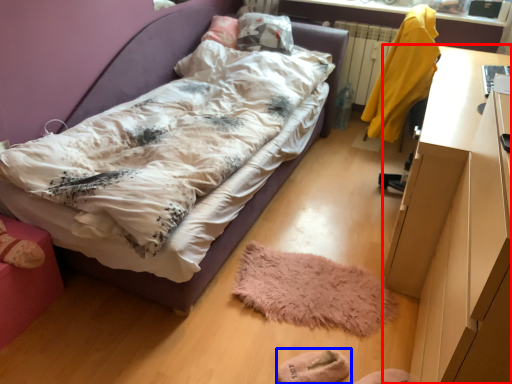
Question: Which of the following is the farthest to the observer, desk (highlighted by a red box) or footwear (highlighted by a blue box)?

Choices:
 (A) desk
 (B) footwear

Answer: (B)